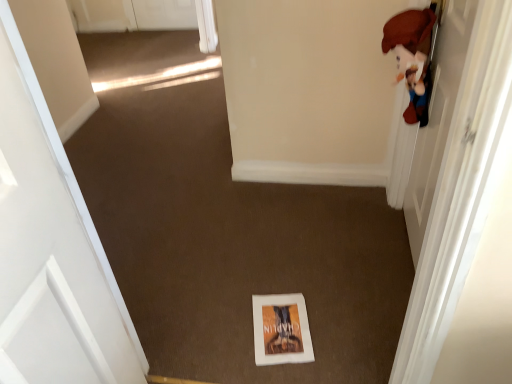
Find the location of a particular element. white paper book at center is located at coordinates (281, 329).

Identify the location of white glossy door at upper right, which is counted as the first door, starting from the right. [x=459, y=192].

Describe the element at coordinates (51, 250) in the screenshot. I see `white matte door at left, positioned as the 2th door in right-to-left order` at that location.

At what (x,y) coordinates should I click in order to perform the action: click on white matte door at left, the 1th door positioned from the left. Please return your answer as a coordinate pair (x, y). Image resolution: width=512 pixels, height=384 pixels. Looking at the image, I should click on (51, 250).

I want to click on white paper book at center, so click(281, 329).

Consider the image. Which point is more forward, [265,338] or [488,72]?

The point [488,72] is closer.

The height and width of the screenshot is (384, 512). I want to click on door that is the 2nd one when counting upward from the white paper book at center (from the image's perspective), so click(459, 192).

Measure the distance from white paper book at center to white glossy door at upper right, which is counted as the first door, starting from the right.

white paper book at center and white glossy door at upper right, which is counted as the first door, starting from the right, are 24.05 inches apart from each other.

Is white paper book at center taller than white glossy door at upper right, which is counted as the first door, starting from the right?

No, white paper book at center is not taller than white glossy door at upper right, which is counted as the first door, starting from the right.

From the picture: Is white matte door at left, positioned as the 2th door in right-to-left order, closer to the viewer compared to white paper book at center?

That is True.

Is point (44, 147) less distant than point (274, 321)?

Yes, it is.

From the image's perspective, which object appears higher, white matte door at left, positioned as the 2th door in right-to-left order, or white paper book at center?

white matte door at left, positioned as the 2th door in right-to-left order, appears higher in the image.

At what (x,y) coordinates should I click in order to perform the action: click on door to the left of white paper book at center. Please return your answer as a coordinate pair (x, y). The image size is (512, 384). Looking at the image, I should click on (51, 250).

From the image's perspective, would you say white glossy door at upper right, which is counted as the first door, starting from the right, is shown under white paper book at center?

No.

Based on the photo, is white glossy door at upper right, positioned as the 2th door in left-to-right order, in contact with white paper book at center?

No, white glossy door at upper right, positioned as the 2th door in left-to-right order, is not in contact with white paper book at center.

From a real-world perspective, between white glossy door at upper right, which is counted as the first door, starting from the right, and white paper book at center, who is vertically lower?

white paper book at center.

In the image, is white glossy door at upper right, positioned as the 2th door in left-to-right order, positioned in front of or behind white paper book at center?

In the image, white glossy door at upper right, positioned as the 2th door in left-to-right order, appears in front of white paper book at center.

Is white paper book at center positioned with its back to white matte door at left, positioned as the 2th door in right-to-left order?

No, white paper book at center's orientation is not away from white matte door at left, positioned as the 2th door in right-to-left order.

Is white paper book at center taller than white matte door at left, positioned as the 2th door in right-to-left order?

No, white paper book at center is not taller than white matte door at left, positioned as the 2th door in right-to-left order.

From the picture: Can white matte door at left, the 1th door positioned from the left, be found inside white paper book at center?

No, white paper book at center does not contain white matte door at left, the 1th door positioned from the left.

Visually, is white paper book at center positioned to the left or to the right of white matte door at left, positioned as the 2th door in right-to-left order?

white paper book at center is positioned on white matte door at left, positioned as the 2th door in right-to-left order,'s right side.

How distant is white glossy door at upper right, which is counted as the first door, starting from the right, from white matte door at left, the 1th door positioned from the left?

white glossy door at upper right, which is counted as the first door, starting from the right, is 31.85 inches away from white matte door at left, the 1th door positioned from the left.

Considering the sizes of objects white glossy door at upper right, positioned as the 2th door in left-to-right order, and white matte door at left, the 1th door positioned from the left, in the image provided, who is thinner, white glossy door at upper right, positioned as the 2th door in left-to-right order, or white matte door at left, the 1th door positioned from the left,?

white matte door at left, the 1th door positioned from the left.

From the image's perspective, relative to white matte door at left, positioned as the 2th door in right-to-left order, is white glossy door at upper right, which is counted as the first door, starting from the right, above or below?

Based on their image positions, white glossy door at upper right, which is counted as the first door, starting from the right, is located above white matte door at left, positioned as the 2th door in right-to-left order.

Looking at this image, is white glossy door at upper right, positioned as the 2th door in left-to-right order, not inside white matte door at left, positioned as the 2th door in right-to-left order?

That's correct, white glossy door at upper right, positioned as the 2th door in left-to-right order, is outside of white matte door at left, positioned as the 2th door in right-to-left order.

From a real-world perspective, is white matte door at left, the 1th door positioned from the left, under white glossy door at upper right, which is counted as the first door, starting from the right?

No, from a real-world perspective, white matte door at left, the 1th door positioned from the left, is not beneath white glossy door at upper right, which is counted as the first door, starting from the right.

Which is less distant, (67, 160) or (490, 137)?

The point (490, 137) is closer to the camera.

Can you see white matte door at left, positioned as the 2th door in right-to-left order, touching white glossy door at upper right, positioned as the 2th door in left-to-right order?

white matte door at left, positioned as the 2th door in right-to-left order, is not next to white glossy door at upper right, positioned as the 2th door in left-to-right order, and they're not touching.

Looking at their sizes, would you say white matte door at left, positioned as the 2th door in right-to-left order, is wider or thinner than white glossy door at upper right, which is counted as the first door, starting from the right?

white matte door at left, positioned as the 2th door in right-to-left order, is thinner than white glossy door at upper right, which is counted as the first door, starting from the right.

From a real-world perspective, starting from the white paper book at center, which door is the 1st one vertically above it? Please provide its 2D coordinates.

[(459, 192)]

From the image's perspective, count 1st doors upward from the white paper book at center and point to it. Please provide its 2D coordinates.

[(51, 250)]

When comparing their distances from white glossy door at upper right, positioned as the 2th door in left-to-right order, does white paper book at center or white matte door at left, positioned as the 2th door in right-to-left order, seem further?

white matte door at left, positioned as the 2th door in right-to-left order, is further to white glossy door at upper right, positioned as the 2th door in left-to-right order.

From the picture: From the image, which object appears to be nearer to white matte door at left, positioned as the 2th door in right-to-left order, white paper book at center or white glossy door at upper right, which is counted as the first door, starting from the right?

white paper book at center is closer to white matte door at left, positioned as the 2th door in right-to-left order.

Based on their spatial positions, is white matte door at left, the 1th door positioned from the left, or white glossy door at upper right, which is counted as the first door, starting from the right, closer to white paper book at center?

Among the two, white glossy door at upper right, which is counted as the first door, starting from the right, is located nearer to white paper book at center.

Looking at the image, which one is located closer to white paper book at center, white glossy door at upper right, positioned as the 2th door in left-to-right order, or white matte door at left, the 1th door positioned from the left?

white glossy door at upper right, positioned as the 2th door in left-to-right order.

In the scene shown: Which object lies further to the anchor point white glossy door at upper right, positioned as the 2th door in left-to-right order, white matte door at left, positioned as the 2th door in right-to-left order, or white paper book at center?

white matte door at left, positioned as the 2th door in right-to-left order, lies further to white glossy door at upper right, positioned as the 2th door in left-to-right order, than the other object.

From the image, which object appears to be farther from white matte door at left, positioned as the 2th door in right-to-left order, white glossy door at upper right, positioned as the 2th door in left-to-right order, or white paper book at center?

white glossy door at upper right, positioned as the 2th door in left-to-right order, is positioned further to the anchor white matte door at left, positioned as the 2th door in right-to-left order.

Identify the location of print between white matte door at left, the 1th door positioned from the left, and white glossy door at upper right, which is counted as the first door, starting from the right. (281, 329).